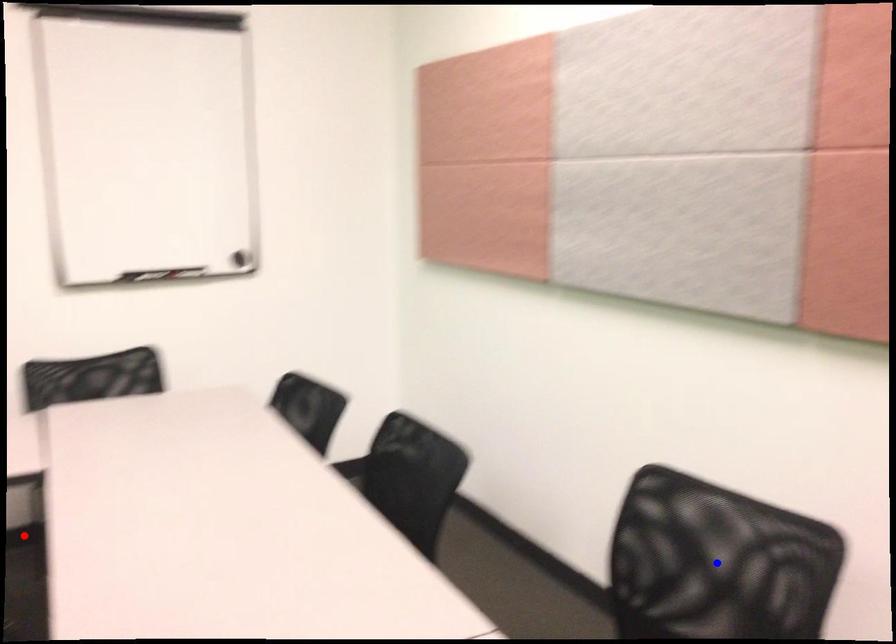
Question: Which of the two points in the image is closer to the camera?

Choices:
 (A) Blue point is closer.
 (B) Red point is closer.

Answer: (A)